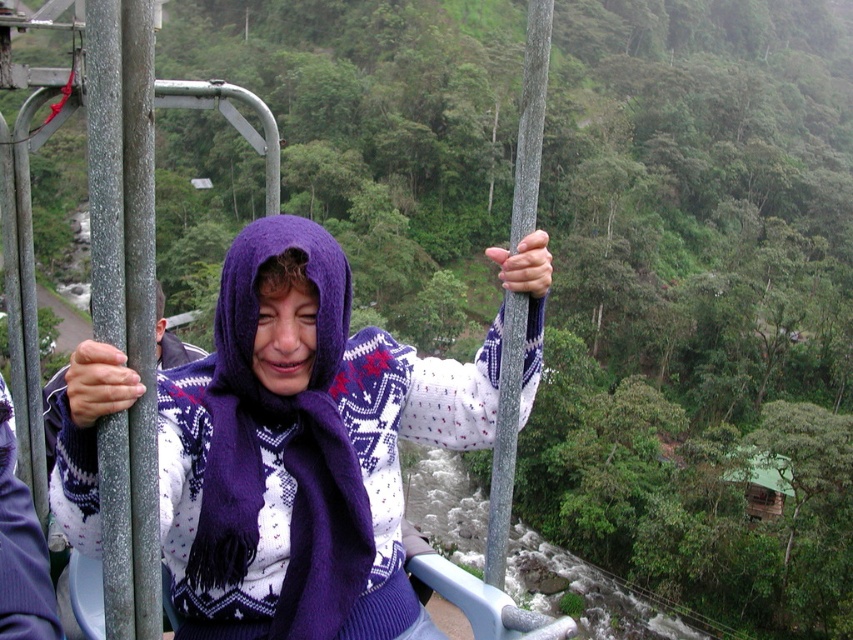
Question: Does purple knitted sweater at center appear on the left side of smooth gray pole at left?

Choices:
 (A) yes
 (B) no

Answer: (B)

Question: Among these objects, which one is farthest from the camera?

Choices:
 (A) smooth metal pole at center
 (B) purple knitted sweater at center

Answer: (B)

Question: Which object is positioned closest to the purple knitted sweater at center?

Choices:
 (A) smooth gray pole at left
 (B) smooth metal pole at center

Answer: (A)

Question: Is purple knitted sweater at center to the right of smooth gray pole at left from the viewer's perspective?

Choices:
 (A) yes
 (B) no

Answer: (A)

Question: Which object appears farthest from the camera in this image?

Choices:
 (A) purple knitted sweater at center
 (B) smooth metal pole at center
 (C) smooth gray pole at left

Answer: (A)

Question: Is purple knitted sweater at center positioned behind smooth metal pole at center?

Choices:
 (A) no
 (B) yes

Answer: (B)